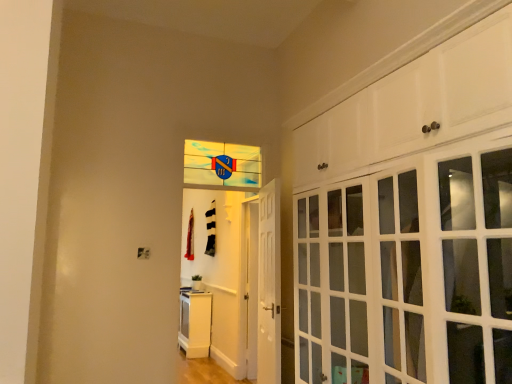
Question: Would you say translucent glass window at center is to the left or to the right of white glossy cabinet at lower left, the first cabinetry when ordered from bottom to top, in the picture?

Choices:
 (A) left
 (B) right

Answer: (B)

Question: Which is correct: translucent glass window at center is inside white glossy cabinet at lower left, which is the first cabinetry in left-to-right order, or outside of it?

Choices:
 (A) inside
 (B) outside

Answer: (B)

Question: Which object is the farthest from the white glossy cabinet at lower left, acting as the second cabinetry starting from the top?

Choices:
 (A) translucent glass window at center
 (B) white glossy door at center
 (C) white glossy cabinet doors at upper right, which is counted as the second cabinetry, starting from the bottom

Answer: (C)

Question: Which of these objects is positioned closest to the white glossy cabinet at lower left, acting as the first cabinetry starting from the back?

Choices:
 (A) translucent glass window at center
 (B) white glossy door at center
 (C) white glossy cabinet doors at upper right, the 2th cabinetry from the back

Answer: (A)